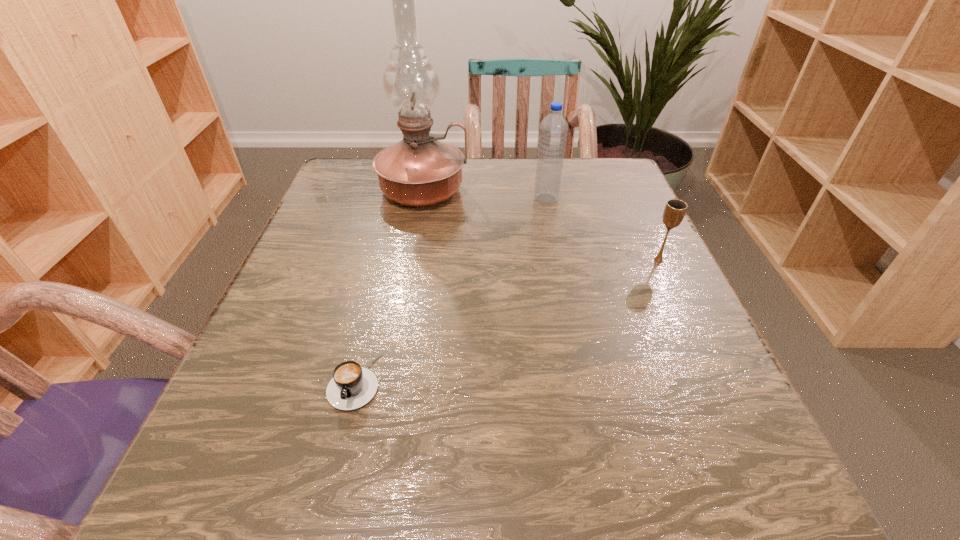
What are the coordinates of `free location at the right edge` in the screenshot? It's located at (695, 340).

Where is `vacant space at the far left corner of the desktop`? vacant space at the far left corner of the desktop is located at coordinates (348, 158).

This screenshot has height=540, width=960. I want to click on free space at the near left corner of the desktop, so click(x=260, y=470).

Where is `free space at the far right corner`? The image size is (960, 540). free space at the far right corner is located at coordinates (579, 160).

Where is `free spot at the near right corner of the desktop`? The width and height of the screenshot is (960, 540). free spot at the near right corner of the desktop is located at coordinates (686, 455).

In order to click on free space between the chalice and the oil lamp in this screenshot , I will do `click(540, 225)`.

In order to click on unoccupied position between the rightmost object and the second tallest object in this screenshot , I will do `click(602, 230)`.

At what (x,y) coordinates should I click in order to perform the action: click on unoccupied position between the tallest object and the chalice. Please return your answer as a coordinate pair (x, y). Looking at the image, I should click on (540, 225).

This screenshot has width=960, height=540. What are the coordinates of `vacant point located between the shortest object and the oil lamp` in the screenshot? It's located at (389, 286).

The width and height of the screenshot is (960, 540). I want to click on vacant region between the third tallest object and the third object from left to right, so click(x=602, y=230).